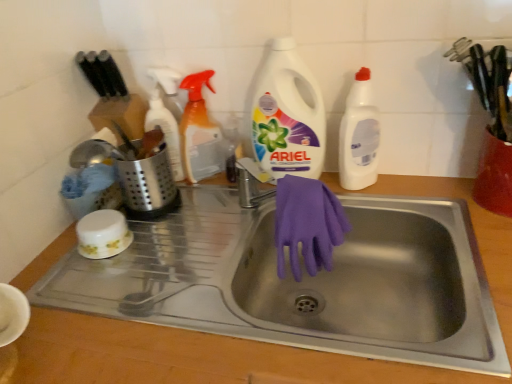
Question: Considering the relative sizes of translucent orange spray bottle at upper center, which appears as the second cleaning product when viewed from the left, and satin silver utensil holder at left, which is counted as the 2th appliance, starting from the right, in the image provided, is translucent orange spray bottle at upper center, which appears as the second cleaning product when viewed from the left, taller than satin silver utensil holder at left, which is counted as the 2th appliance, starting from the right,?

Choices:
 (A) yes
 (B) no

Answer: (A)

Question: Is translucent orange spray bottle at upper center, marked as the third cleaning product in a right-to-left arrangement, to the left of satin silver utensil holder at left, which is counted as the 2th appliance, starting from the right, from the viewer's perspective?

Choices:
 (A) no
 (B) yes

Answer: (A)

Question: From the image's perspective, is translucent orange spray bottle at upper center, which appears as the second cleaning product when viewed from the left, over satin silver utensil holder at left, marked as the 1th appliance in a left-to-right arrangement?

Choices:
 (A) no
 (B) yes

Answer: (B)

Question: Are translucent orange spray bottle at upper center, which appears as the second cleaning product when viewed from the left, and satin silver utensil holder at left, marked as the 1th appliance in a left-to-right arrangement, beside each other?

Choices:
 (A) yes
 (B) no

Answer: (B)

Question: Is translucent orange spray bottle at upper center, marked as the third cleaning product in a right-to-left arrangement, positioned behind satin silver utensil holder at left, which is counted as the 2th appliance, starting from the right?

Choices:
 (A) no
 (B) yes

Answer: (B)

Question: Considering the positions of point pos(304,91) and point pos(202,125), is point pos(304,91) closer or farther from the camera than point pos(202,125)?

Choices:
 (A) farther
 (B) closer

Answer: (B)

Question: Is white plastic detergent at center, acting as the 2th cleaning product starting from the right, in front of or behind translucent orange spray bottle at upper center, which appears as the second cleaning product when viewed from the left, in the image?

Choices:
 (A) front
 (B) behind

Answer: (A)

Question: Looking at their shapes, would you say white plastic detergent at center, marked as the 3th cleaning product in a left-to-right arrangement, is wider or thinner than translucent orange spray bottle at upper center, marked as the third cleaning product in a right-to-left arrangement?

Choices:
 (A) wide
 (B) thin

Answer: (B)

Question: Considering the positions of white plastic detergent at center, marked as the 3th cleaning product in a left-to-right arrangement, and translucent orange spray bottle at upper center, which appears as the second cleaning product when viewed from the left, in the image, is white plastic detergent at center, marked as the 3th cleaning product in a left-to-right arrangement, bigger or smaller than translucent orange spray bottle at upper center, which appears as the second cleaning product when viewed from the left,?

Choices:
 (A) big
 (B) small

Answer: (A)

Question: From the image's perspective, is translucent plastic spray bottle at upper center, positioned as the 1th cleaning product in left-to-right order, located above or below stainless steel sink at center?

Choices:
 (A) below
 (B) above

Answer: (B)

Question: From their relative heights in the image, would you say translucent plastic spray bottle at upper center, positioned as the 1th cleaning product in left-to-right order, is taller or shorter than stainless steel sink at center?

Choices:
 (A) short
 (B) tall

Answer: (A)

Question: Based on their sizes in the image, would you say translucent plastic spray bottle at upper center, positioned as the fourth cleaning product in right-to-left order, is bigger or smaller than stainless steel sink at center?

Choices:
 (A) big
 (B) small

Answer: (B)

Question: In terms of width, does translucent plastic spray bottle at upper center, positioned as the 1th cleaning product in left-to-right order, look wider or thinner when compared to stainless steel sink at center?

Choices:
 (A) thin
 (B) wide

Answer: (A)

Question: Is point (187, 170) positioned closer to the camera than point (298, 178)?

Choices:
 (A) farther
 (B) closer

Answer: (A)

Question: Is translucent orange spray bottle at upper center, marked as the third cleaning product in a right-to-left arrangement, to the left or to the right of purple rubber gloves at sink in the image?

Choices:
 (A) right
 (B) left

Answer: (B)